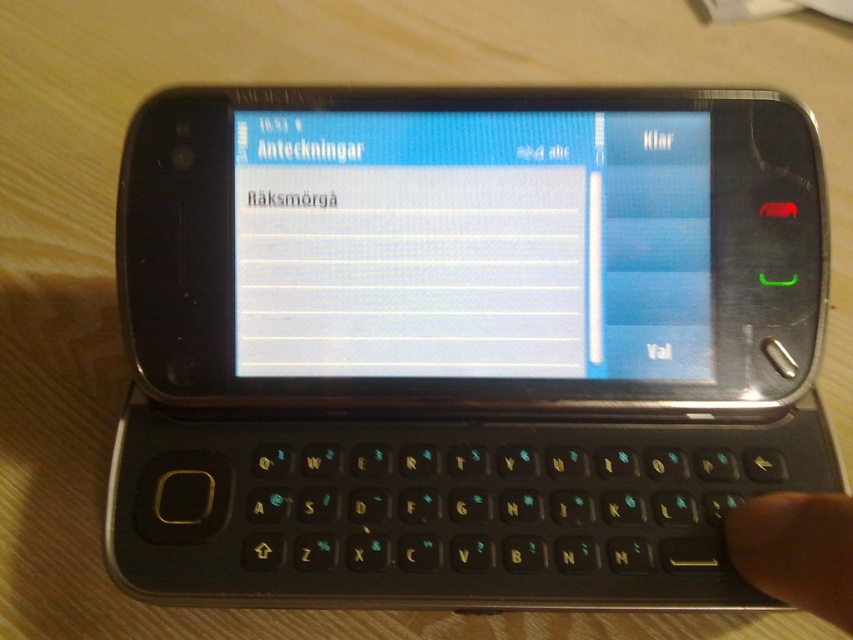
You are holding a classic mobile phone from the early 2000s. You notice a white glossy screen at center and a skinsmoothhand at lower right. Which object is bigger in size?

The white glossy screen at center is larger in size compared to the skinsmoothhand at lower right.

You are holding the classic mobile phone from the early 2000s shown in the image. You notice two points marked on the phone. The first point is at coordinates point (254, 112) and the second is at point (780, 531). Which point is closer to your eyes when you are looking directly at the phone?

Point (254, 112) is closer to your eyes because it is further to the viewer than point (780, 531).

You are a delivery person who needs to place a package between the white glossy screen at center and the camera. The package is 30 inches long. Will it fit between them?

The distance between the white glossy screen at center and the camera is 32.38 inches, so the 30 inch package will fit between them.